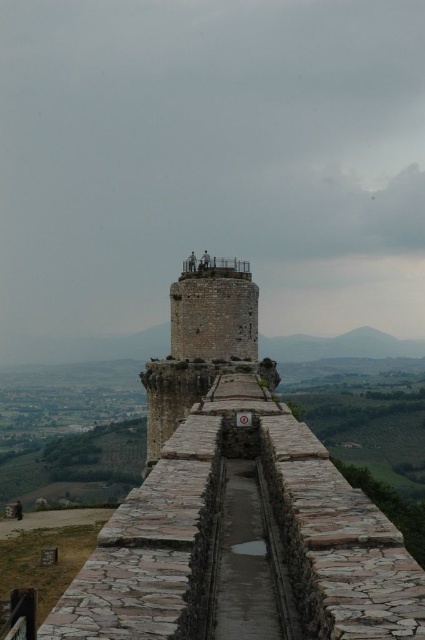
Measure the distance from stone tower at center to rustic stone tower at center.

They are 16.01 feet apart.

Does stone tower at center have a lesser height compared to rustic stone tower at center?

No.

Who is more distant from viewer, (164, 444) or (184, 301)?

The point (184, 301) is more distant.

Identify the location of stone tower at center. (237, 504).